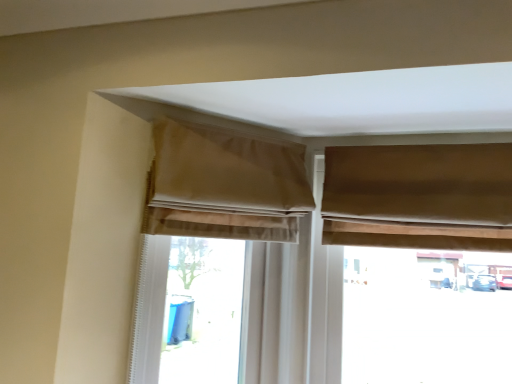
Question: Does beige fabric curtain at upper center, which is the 2th curtain from right to left, have a greater height compared to beige fabric curtain at upper left, the 1th curtain from the left?

Choices:
 (A) yes
 (B) no

Answer: (B)

Question: Does beige fabric curtain at upper center, the second curtain in the left-to-right sequence, have a smaller size compared to beige fabric curtain at upper left, the 1th curtain from the left?

Choices:
 (A) no
 (B) yes

Answer: (B)

Question: From the image's perspective, is beige fabric curtain at upper center, which is the 2th curtain from right to left, above beige fabric curtain at upper left, the third curtain when ordered from right to left?

Choices:
 (A) yes
 (B) no

Answer: (A)

Question: From a real-world perspective, is beige fabric curtain at upper center, the second curtain in the left-to-right sequence, located beneath beige fabric curtain at upper left, the third curtain when ordered from right to left?

Choices:
 (A) yes
 (B) no

Answer: (B)

Question: Is beige fabric curtain at upper center, the second curtain in the left-to-right sequence, closer to camera compared to beige fabric curtain at upper left, the 1th curtain from the left?

Choices:
 (A) no
 (B) yes

Answer: (B)

Question: From the image's perspective, relative to matte brown curtain at upper right, marked as the 3th curtain in a left-to-right arrangement, is beige fabric window at upper center above or below?

Choices:
 (A) below
 (B) above

Answer: (A)

Question: Is point (266, 168) closer or farther from the camera than point (388, 231)?

Choices:
 (A) farther
 (B) closer

Answer: (A)

Question: Is beige fabric window at upper center bigger or smaller than matte brown curtain at upper right, marked as the first curtain in a right-to-left arrangement?

Choices:
 (A) small
 (B) big

Answer: (B)

Question: Do you think beige fabric window at upper center is within matte brown curtain at upper right, marked as the first curtain in a right-to-left arrangement, or outside of it?

Choices:
 (A) outside
 (B) inside

Answer: (A)

Question: From the image's perspective, is matte brown curtain at upper right, marked as the 3th curtain in a left-to-right arrangement, positioned above or below beige fabric curtain at upper left, the third curtain when ordered from right to left?

Choices:
 (A) below
 (B) above

Answer: (B)

Question: Is matte brown curtain at upper right, marked as the first curtain in a right-to-left arrangement, bigger or smaller than beige fabric curtain at upper left, the 1th curtain from the left?

Choices:
 (A) big
 (B) small

Answer: (B)

Question: Choose the correct answer: Is matte brown curtain at upper right, marked as the 3th curtain in a left-to-right arrangement, inside beige fabric curtain at upper left, the third curtain when ordered from right to left, or outside it?

Choices:
 (A) inside
 (B) outside

Answer: (B)

Question: Is point (404, 195) positioned closer to the camera than point (182, 157)?

Choices:
 (A) farther
 (B) closer

Answer: (A)

Question: From their relative heights in the image, would you say matte brown curtain at upper right, marked as the first curtain in a right-to-left arrangement, is taller or shorter than beige fabric window at upper center?

Choices:
 (A) tall
 (B) short

Answer: (B)

Question: Is point (480, 249) positioned closer to the camera than point (228, 226)?

Choices:
 (A) closer
 (B) farther

Answer: (A)